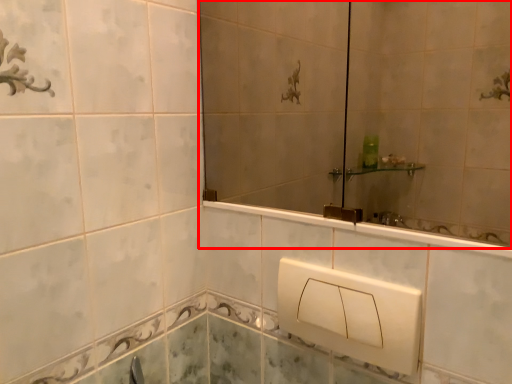
Question: Observing the image, what is the correct spatial positioning of mirror (annotated by the red box) in reference to square?

Choices:
 (A) right
 (B) left

Answer: (B)